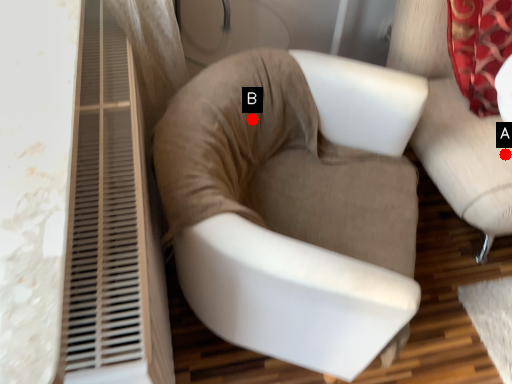
Question: Two points are circled on the image, labeled by A and B beside each circle. Which point is closer to the camera?

Choices:
 (A) A is closer
 (B) B is closer

Answer: (B)